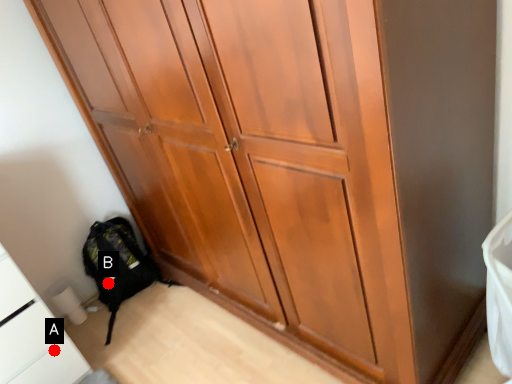
Question: Two points are circled on the image, labeled by A and B beside each circle. Among these points, which one is nearest to the camera?

Choices:
 (A) A is closer
 (B) B is closer

Answer: (A)